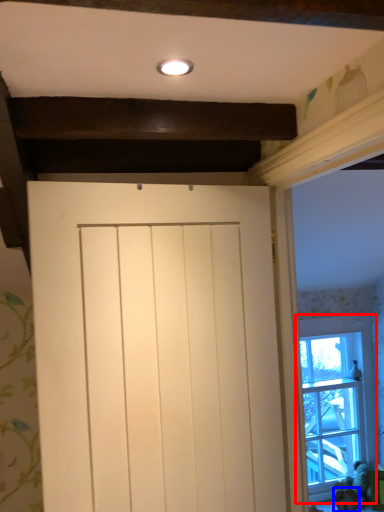
Question: Which object appears closest to the camera in this image, window (highlighted by a red box) or animal (highlighted by a blue box)?

Choices:
 (A) window
 (B) animal

Answer: (B)